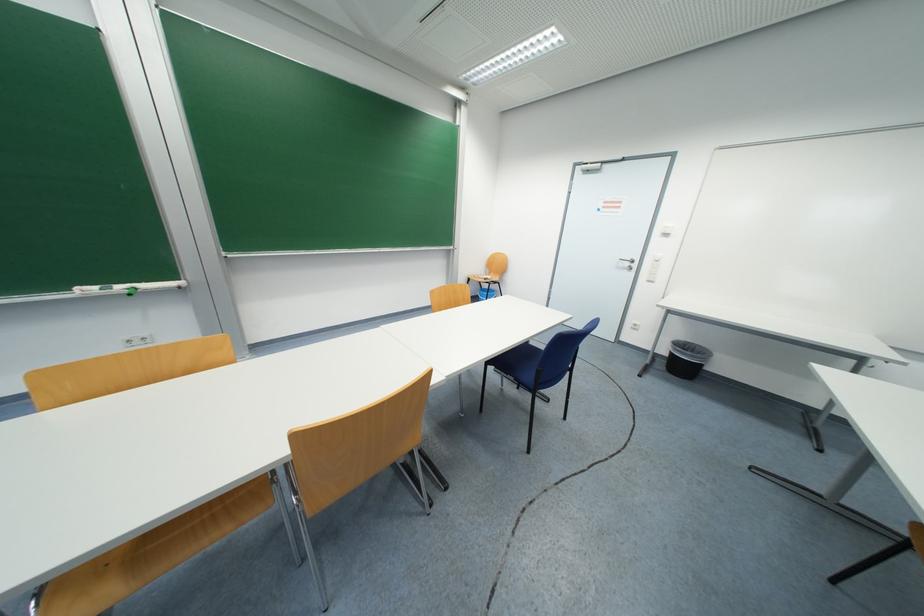
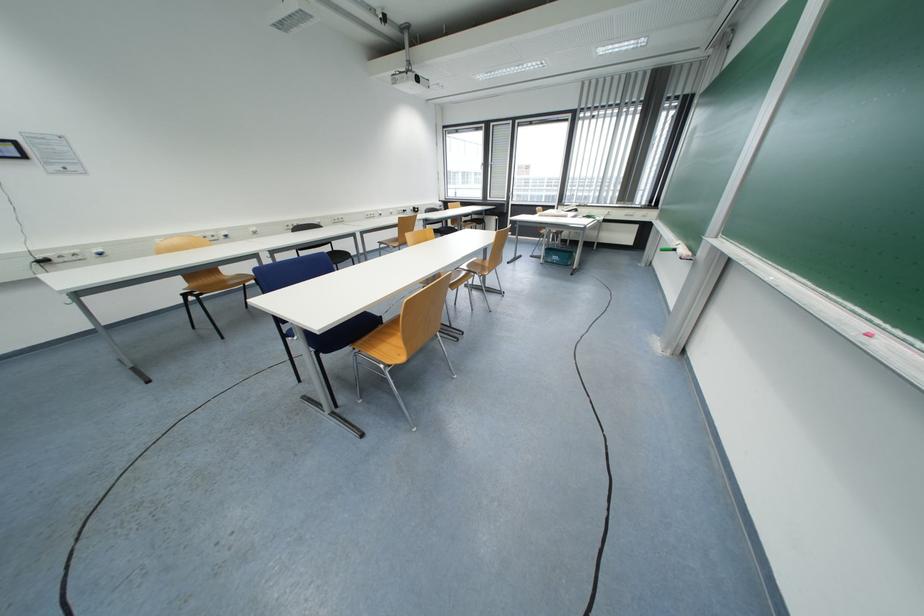
In the second image, find the point that corresponds to [100,289] in the first image.

(683, 244)